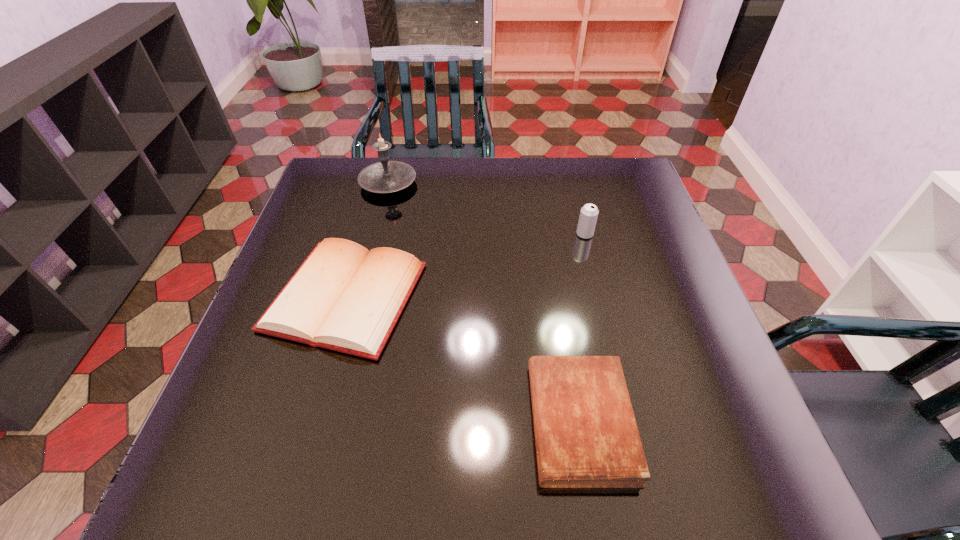
The width and height of the screenshot is (960, 540). In the image, there is a desktop. Identify the location of vacant area at the near edge. (448, 460).

The width and height of the screenshot is (960, 540). What are the coordinates of `blank area at the left edge` in the screenshot? It's located at (350, 237).

Locate an element on the screen. free space at the right edge is located at coordinates (647, 279).

This screenshot has height=540, width=960. I want to click on blank space at the far left corner, so click(x=325, y=180).

In order to click on vacant region at the near left corner of the desktop in this screenshot , I will do `click(204, 500)`.

In the image, there is a desktop. At what (x,y) coordinates should I click in order to perform the action: click on vacant space at the far right corner. Please return your answer as a coordinate pair (x, y). This screenshot has height=540, width=960. Looking at the image, I should click on (611, 170).

Where is `free location at the near right corner of the desktop`? The width and height of the screenshot is (960, 540). free location at the near right corner of the desktop is located at coordinates (720, 488).

Where is `free area in between the candle and the beer can`? free area in between the candle and the beer can is located at coordinates (487, 208).

The image size is (960, 540). I want to click on free space that is in between the farthest object and the second nearest object, so click(x=367, y=240).

Find the location of a particular element. This screenshot has width=960, height=540. blank region between the nearest object and the farthest object is located at coordinates (484, 302).